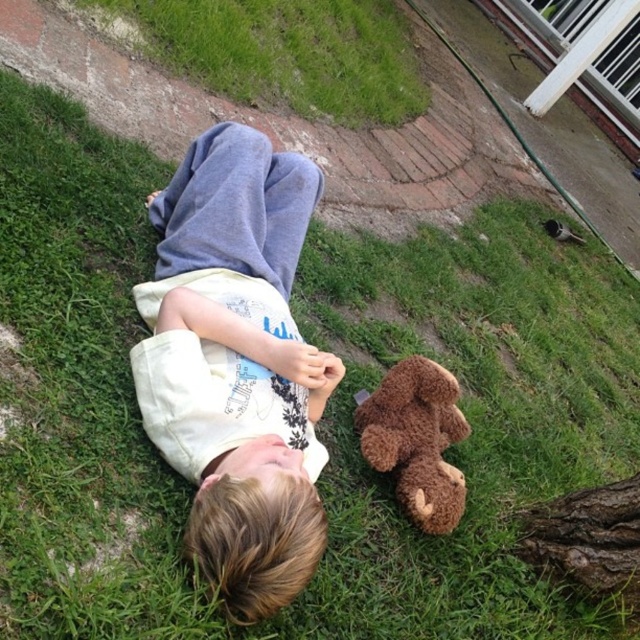
What do you see at coordinates (417, 440) in the screenshot? The width and height of the screenshot is (640, 640). I see `brown plush teddy bear at lower center` at bounding box center [417, 440].

Which is more to the left, brown plush teddy bear at lower center or black fuzzy bird at upper right?

Positioned to the left is brown plush teddy bear at lower center.

Is point (436, 445) more distant than point (552, 224)?

No.

What are the coordinates of `brown plush teddy bear at lower center` in the screenshot? It's located at (417, 440).

Is point (140, 36) closer to camera compared to point (403, 365)?

No, it is behind (403, 365).

Does green grass at upper left have a lesser height compared to brown plush teddy bear at lower center?

No.

Is point (312, 84) behind point (458, 477)?

That is True.

Where is `green grass at upper left`? The height and width of the screenshot is (640, 640). green grass at upper left is located at coordinates (284, 52).

Can you confirm if white cotton shirt at center is positioned below black fuzzy bird at upper right?

Correct, white cotton shirt at center is located below black fuzzy bird at upper right.

Is point (202, 160) positioned after point (545, 220)?

No, (202, 160) is closer to viewer.

This screenshot has width=640, height=640. In order to click on white cotton shirt at center in this screenshot , I will do `click(236, 364)`.